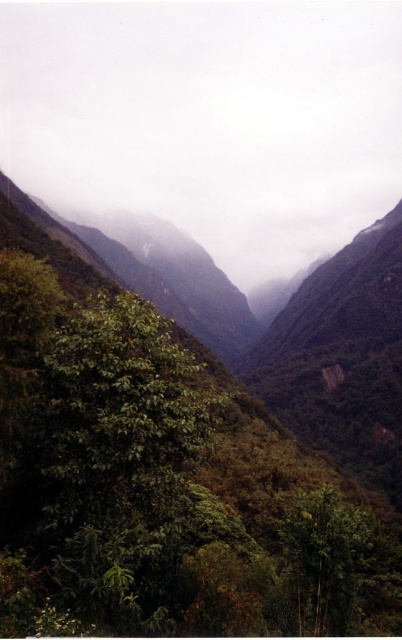
You are an environmental scientist analyzing the valley. You notice the green matte cloud at center and the green leafy tree at center. Which object has a greater width?

The green matte cloud at center has a greater width than the green leafy tree at center according to the description.